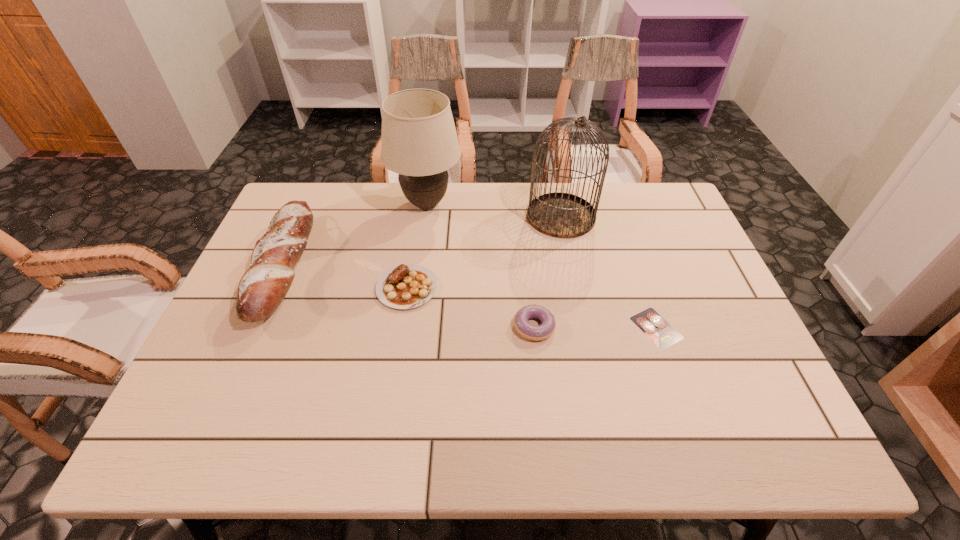
Find the location of a particular element. The height and width of the screenshot is (540, 960). empty space that is in between the lampshade and the birdcage is located at coordinates (493, 210).

Where is `vacant point located between the lampshade and the doughnut`? This screenshot has height=540, width=960. vacant point located between the lampshade and the doughnut is located at coordinates (480, 265).

This screenshot has width=960, height=540. Find the location of `free space that is in between the salami and the birdcage`. free space that is in between the salami and the birdcage is located at coordinates (609, 272).

Where is `vacant point located between the leftmost object and the lampshade`? The width and height of the screenshot is (960, 540). vacant point located between the leftmost object and the lampshade is located at coordinates (355, 235).

The width and height of the screenshot is (960, 540). Find the location of `object that can be found as the third closest to the birdcage`. object that can be found as the third closest to the birdcage is located at coordinates (536, 333).

I want to click on object that stands as the closest to the birdcage, so click(419, 141).

You are a GUI agent. You are given a task and a screenshot of the screen. Output one action in this format:
    pyautogui.click(x=<x>, y=<y>)
    Task: Click on the free space that satisfies the following two spatial constraints: 1. on the front side of the baguet; 2. on the right side of the doughnut
    Image resolution: width=960 pixels, height=540 pixels.
    Given the screenshot: What is the action you would take?
    pyautogui.click(x=257, y=327)

This screenshot has height=540, width=960. Identify the location of free space that satisfies the following two spatial constraints: 1. on the front side of the doughnut; 2. on the right side of the leftmost object. (257, 327).

Identify the location of vacant region that satisfies the following two spatial constraints: 1. on the front side of the third tallest object; 2. on the right side of the shortest object. (257, 328).

Locate an element on the screen. This screenshot has height=540, width=960. vacant region that satisfies the following two spatial constraints: 1. on the back side of the birdcage; 2. on the right side of the baguet is located at coordinates (306, 217).